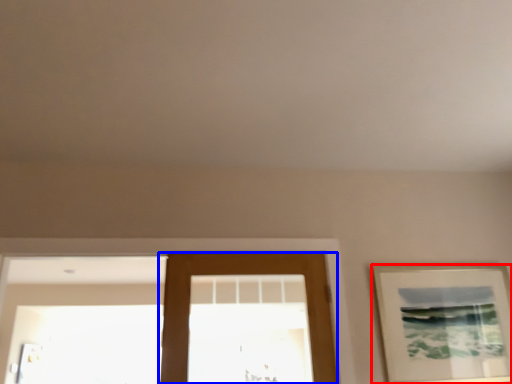
Question: Which object is further to the camera taking this photo, picture frame (highlighted by a red box) or door (highlighted by a blue box)?

Choices:
 (A) picture frame
 (B) door

Answer: (A)